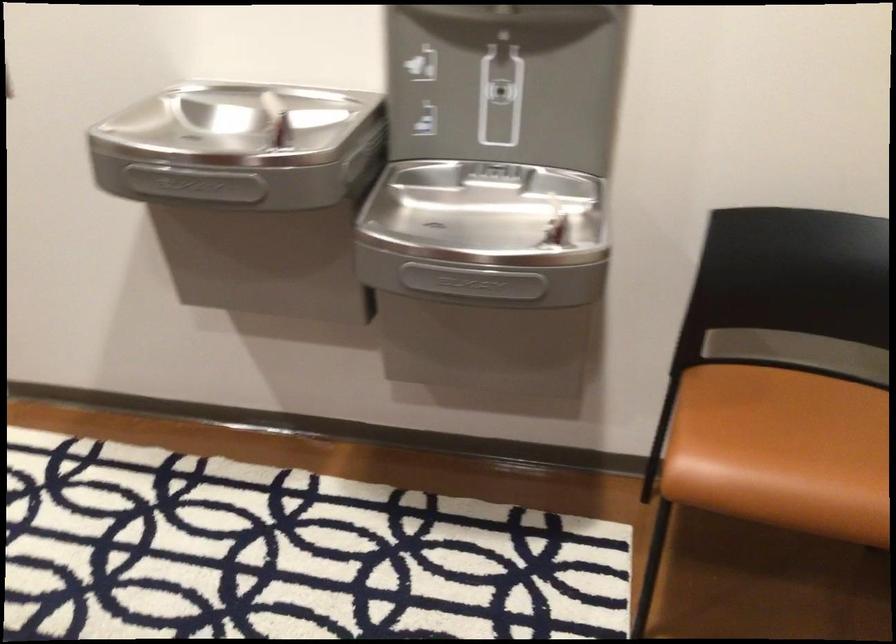
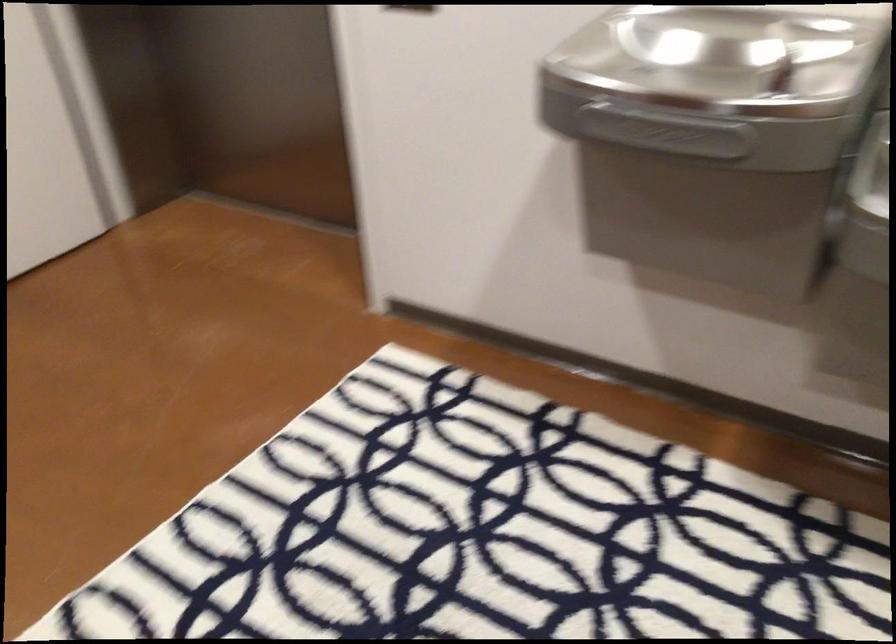
Question: The camera is either moving clockwise (left) or counter-clockwise (right) around the object. The first image is from the beginning of the video and the second image is from the end. Is the camera moving left or right when shooting the video?

Choices:
 (A) Left
 (B) Right

Answer: (B)